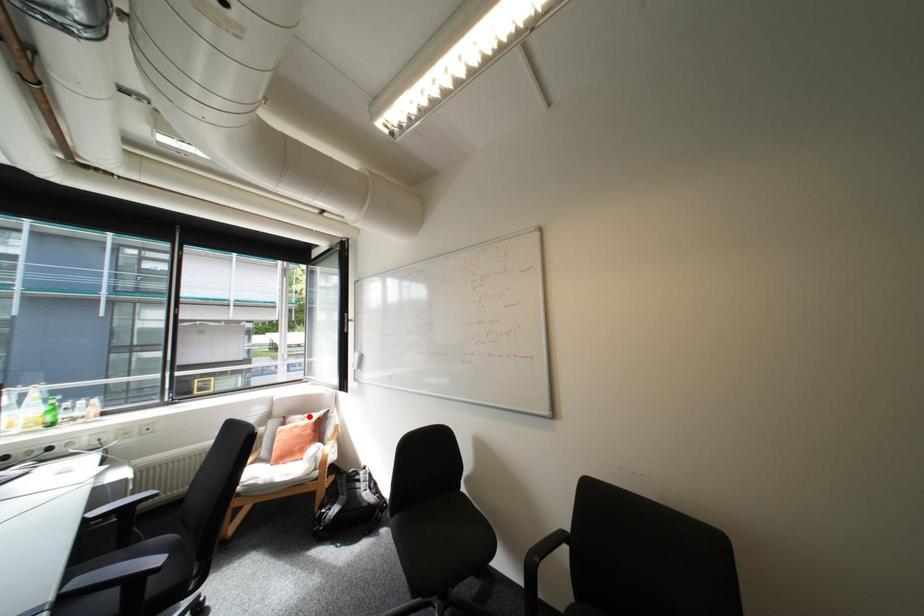
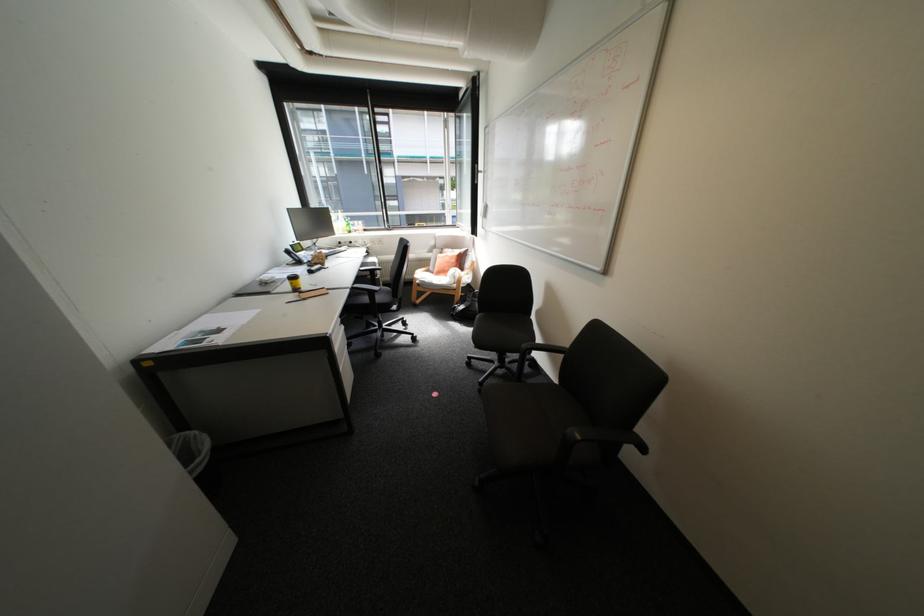
Locate, in the second image, the point that corresponds to the highlighted location in the first image.

(459, 249)